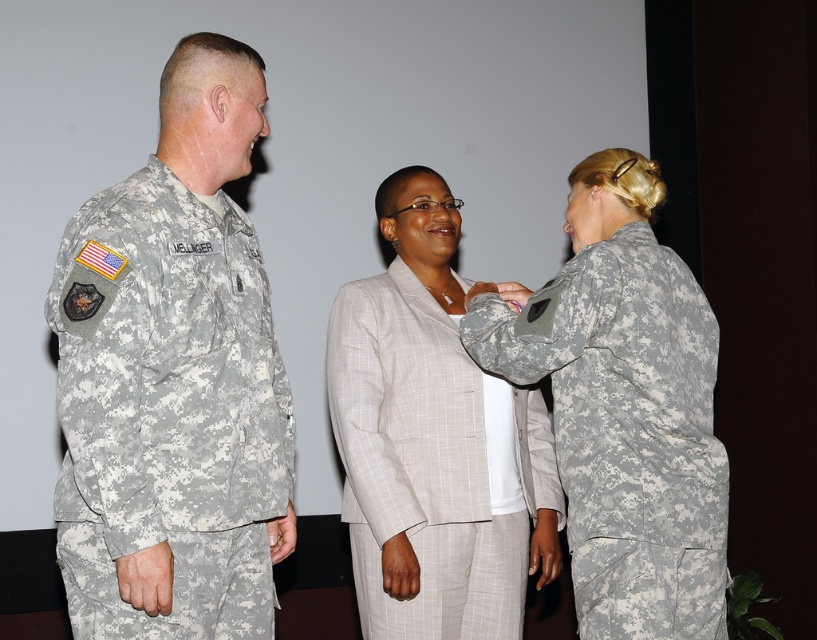
Question: Estimate the real-world distances between objects in this image. Which object is farther from the camouflage uniform at left?

Choices:
 (A) light beige fabric suit at center
 (B) camouflage uniform at right

Answer: (B)

Question: Does camouflage uniform at right have a larger size compared to light beige fabric suit at center?

Choices:
 (A) no
 (B) yes

Answer: (B)

Question: Does camouflage uniform at left have a lesser width compared to camouflage uniform at right?

Choices:
 (A) no
 (B) yes

Answer: (B)

Question: Which point is farther to the camera?

Choices:
 (A) (623, 262)
 (B) (168, 260)
 (C) (463, 566)

Answer: (C)

Question: Is camouflage uniform at left below camouflage uniform at right?

Choices:
 (A) no
 (B) yes

Answer: (A)

Question: Considering the real-world distances, which object is farthest from the camouflage uniform at right?

Choices:
 (A) light beige fabric suit at center
 (B) camouflage uniform at left

Answer: (B)